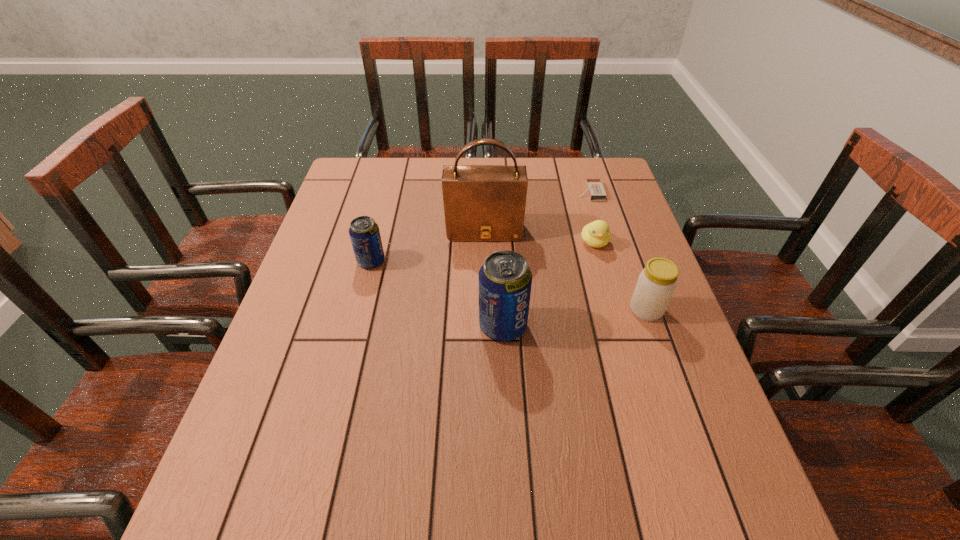
At what (x,y) coordinates should I click in order to perform the action: click on vacant space located 0.100m on the back of the taller soda. Please return your answer as a coordinate pair (x, y). Looking at the image, I should click on (500, 278).

The height and width of the screenshot is (540, 960). I want to click on free space located on the striking surface of the shortest object, so click(515, 192).

Identify the location of vacant area situated on the striking surface of the shortest object. This screenshot has height=540, width=960. (495, 192).

This screenshot has height=540, width=960. In order to click on vacant space located on the striking surface of the shortest object in this screenshot , I will do `click(546, 192)`.

Locate an element on the screen. vacant area located at the beak of the duckling is located at coordinates (629, 362).

You are a GUI agent. You are given a task and a screenshot of the screen. Output one action in this format:
    pyautogui.click(x=<x>, y=<y>)
    Task: Click on the blank area located 0.200m on the front flap of the tallest object
    
    Given the screenshot: What is the action you would take?
    pyautogui.click(x=485, y=297)

Locate an element on the screen. This screenshot has width=960, height=540. vacant space located on the back of the jar is located at coordinates (620, 235).

At what (x,y) coordinates should I click in order to perform the action: click on object present at the far edge. Please return your answer as a coordinate pair (x, y). This screenshot has height=540, width=960. Looking at the image, I should click on (595, 188).

The height and width of the screenshot is (540, 960). I want to click on object at the left edge, so click(x=364, y=232).

In order to click on matchbox positioned at the right edge in this screenshot , I will do `click(595, 188)`.